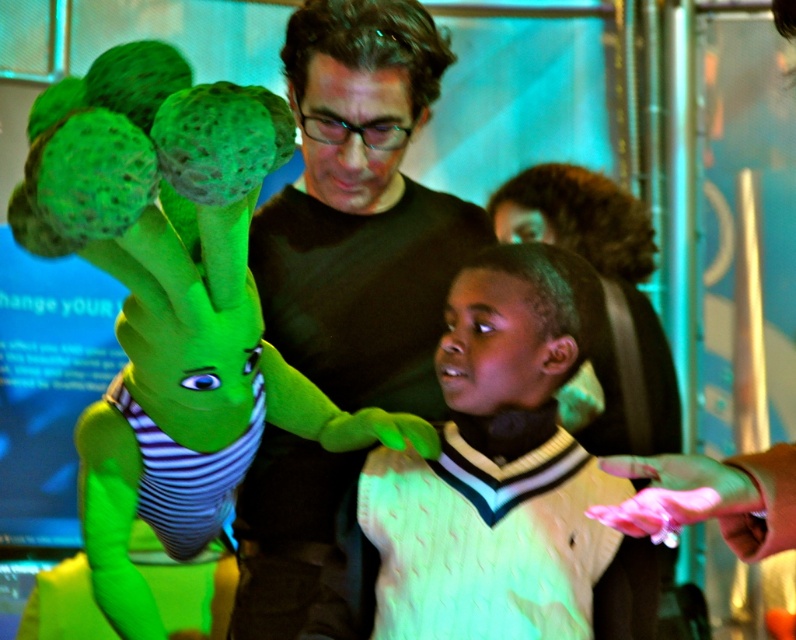
Which is below, green rubber alien at upper left or white knitted sweater at center?

white knitted sweater at center is below.

How distant is green rubber alien at upper left from white knitted sweater at center?

green rubber alien at upper left and white knitted sweater at center are 10.23 inches apart.

This screenshot has height=640, width=796. What do you see at coordinates (174, 317) in the screenshot? I see `green rubber alien at upper left` at bounding box center [174, 317].

At what (x,y) coordinates should I click in order to perform the action: click on green rubber alien at upper left. Please return your answer as a coordinate pair (x, y). The height and width of the screenshot is (640, 796). Looking at the image, I should click on (174, 317).

Between point (338, 300) and point (514, 336), which one is positioned behind?

The point (338, 300) is more distant.

Describe the element at coordinates (361, 211) in the screenshot. I see `matte black sweater at center` at that location.

Does point (412, 301) come closer to viewer compared to point (492, 349)?

No, it is behind (492, 349).

Where is `matte black sweater at center`? matte black sweater at center is located at coordinates (361, 211).

Who is positioned more to the left, green rubber alien at upper left or matte black sweater at center?

From the viewer's perspective, green rubber alien at upper left appears more on the left side.

Describe the element at coordinates (174, 317) in the screenshot. I see `green rubber alien at upper left` at that location.

Does point (92, 461) lie behind point (338, 56)?

Yes, point (92, 461) is behind point (338, 56).

The image size is (796, 640). I want to click on green rubber alien at upper left, so click(174, 317).